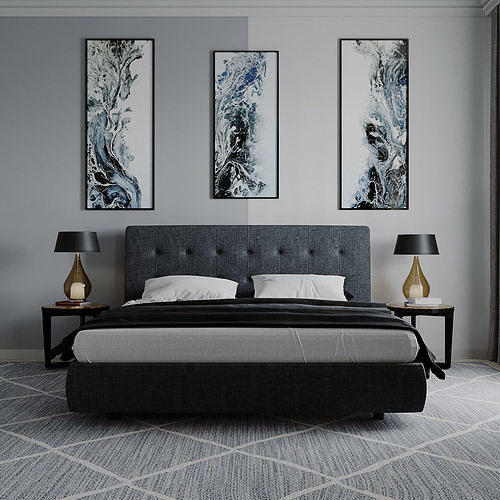
You are a GUI agent. You are given a task and a screenshot of the screen. Output one action in this format:
    pyautogui.click(x=<x>, y=<y>)
    Task: Click on the headboard
    
    Given the screenshot: What is the action you would take?
    pyautogui.click(x=249, y=261)